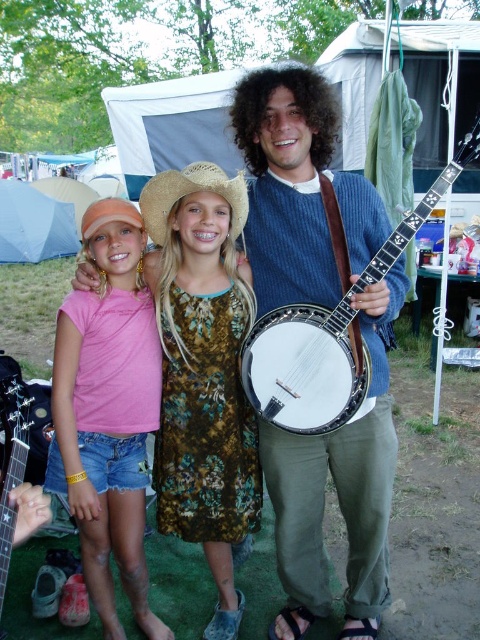
Is blue knitted sweater at center above pink fabric dress at center?

Yes.

Does blue knitted sweater at center have a greater width compared to pink fabric dress at center?

Yes.

Is point (394, 268) positioned after point (189, 381)?

No, it is in front of (189, 381).

Where is `blue knitted sweater at center`? The image size is (480, 640). blue knitted sweater at center is located at coordinates (337, 492).

Does pink cotton shirt at left appear on the left side of strawhat at center?

Correct, you'll find pink cotton shirt at left to the left of strawhat at center.

Which of these two, pink cotton shirt at left or strawhat at center, stands taller?

pink cotton shirt at left

Is point (63, 339) positioned in front of point (163, 200)?

Yes, it is.

Locate an element on the screen. The image size is (480, 640). pink cotton shirt at left is located at coordinates (108, 412).

Which is behind, point (346, 593) or point (240, 173)?

The point (346, 593) is behind.

The height and width of the screenshot is (640, 480). What do you see at coordinates (337, 492) in the screenshot?
I see `blue knitted sweater at center` at bounding box center [337, 492].

Find the location of a particular element. blue knitted sweater at center is located at coordinates (337, 492).